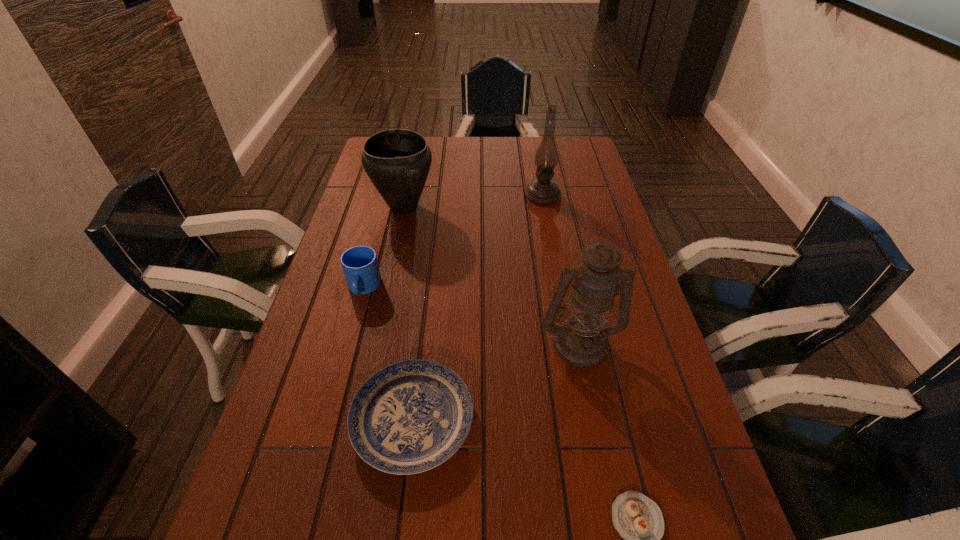
Locate an element on the screen. The height and width of the screenshot is (540, 960). vacant area that lies between the second nearest object and the farther oil lamp is located at coordinates (477, 307).

Identify which object is the third nearest to the fourth nearest object. Please provide its 2D coordinates. Your answer should be formatted as a tuple, i.e. [(x, y)], where the tuple contains the x and y coordinates of a point satisfying the conditions above.

[(581, 340)]

Select which object appears as the fourth closest to the nearest object. Please provide its 2D coordinates. Your answer should be formatted as a tuple, i.e. [(x, y)], where the tuple contains the x and y coordinates of a point satisfying the conditions above.

[(397, 161)]

Find the location of a particular element. free space that satisfies the following two spatial constraints: 1. on the side of the mug with the handle; 2. on the right side of the nearer oil lamp is located at coordinates (348, 342).

Image resolution: width=960 pixels, height=540 pixels. What are the coordinates of `free location that satisfies the following two spatial constraints: 1. on the side of the fourth farthest object with the handle; 2. on the left side of the third farthest object` in the screenshot? It's located at (348, 342).